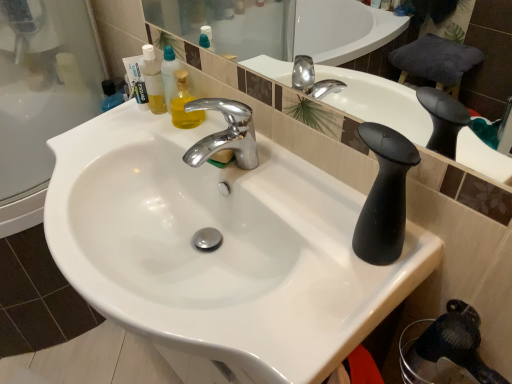
Identify the location of vacant space in front of white matte toothpaste tube at upper left. The width and height of the screenshot is (512, 384). (126, 137).